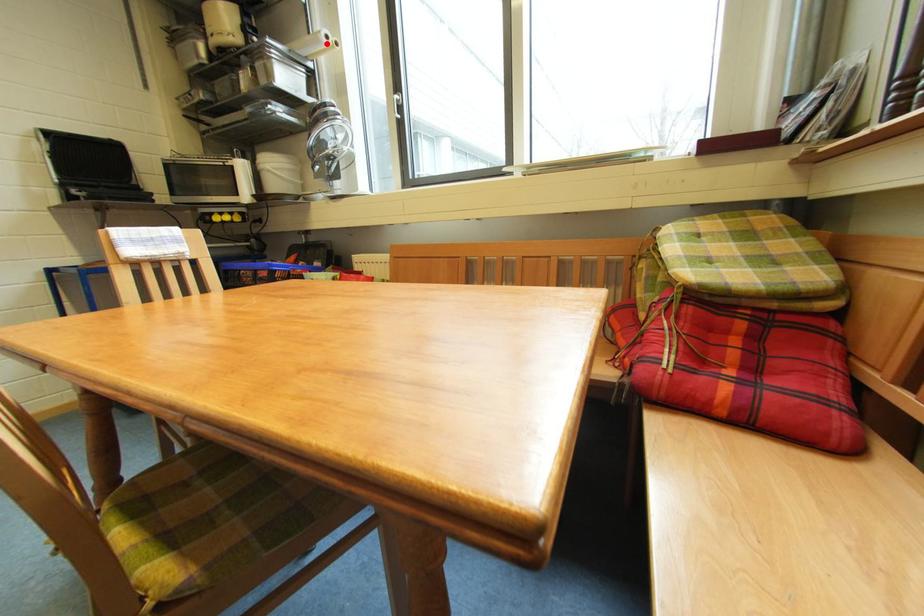
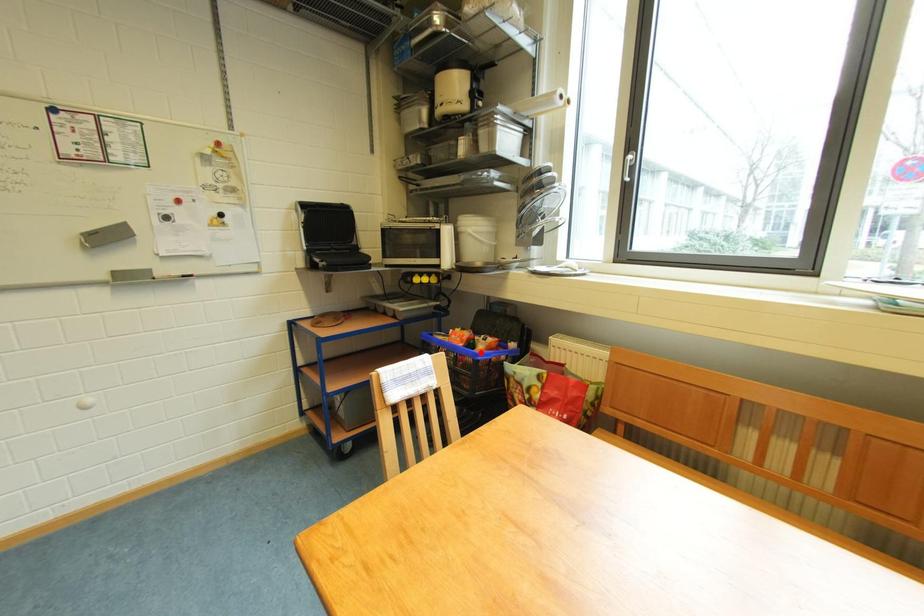
I am providing you with two images of the same scene from different viewpoints. A red point is marked on the first image and another point is marked on the second image. Does the point marked in image1 correspond to the same location as the one in image2?

No